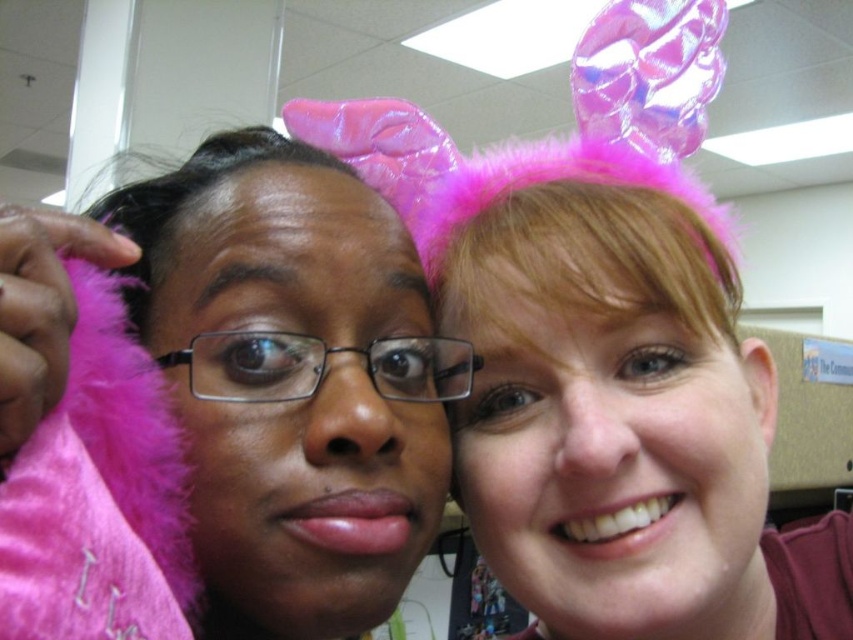
Identify the location of pink fluffy headband at upper right. Image resolution: width=853 pixels, height=640 pixels. pos(621,426).

Is pink fluffy headband at upper right bigger than pink fluffy ear at upper right?

Indeed, pink fluffy headband at upper right has a larger size compared to pink fluffy ear at upper right.

At what (x,y) coordinates should I click in order to perform the action: click on pink fluffy headband at upper right. Please return your answer as a coordinate pair (x, y). The image size is (853, 640). Looking at the image, I should click on (621, 426).

The width and height of the screenshot is (853, 640). In order to click on pink fluffy headband at upper right in this screenshot , I will do `click(621, 426)`.